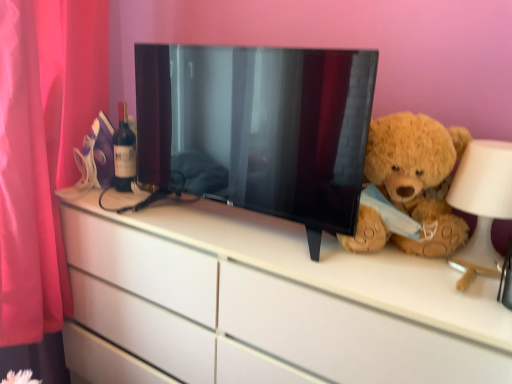
The width and height of the screenshot is (512, 384). What are the coordinates of `free point in front of fuzzy brown teddy bear at right` in the screenshot? It's located at (413, 288).